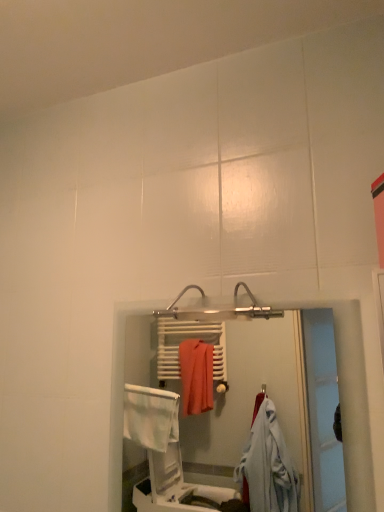
The image size is (384, 512). Describe the element at coordinates (215, 424) in the screenshot. I see `white plastic towel rack at center` at that location.

Find the location of `white plastic towel rack at center`. white plastic towel rack at center is located at coordinates (215, 424).

The height and width of the screenshot is (512, 384). Find the location of `white plastic towel rack at center`. white plastic towel rack at center is located at coordinates (215, 424).